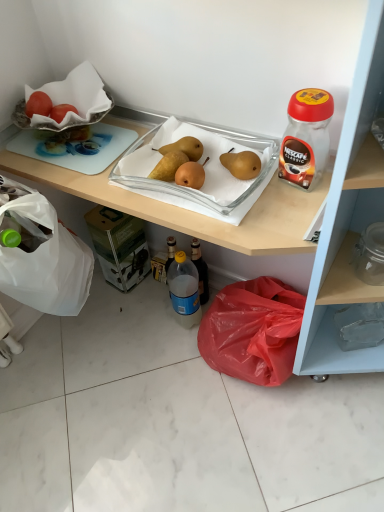
Question: From a real-world perspective, is blue translucent bottle at center, the second bottle when ordered from right to left, on top of matte plastic cabinet at lower right?

Choices:
 (A) yes
 (B) no

Answer: (B)

Question: Can you confirm if blue translucent bottle at center, which is the first bottle from bottom to top, is positioned to the right of matte plastic cabinet at lower right?

Choices:
 (A) yes
 (B) no

Answer: (B)

Question: Considering the relative sizes of blue translucent bottle at center, the second bottle when ordered from right to left, and matte plastic cabinet at lower right in the image provided, is blue translucent bottle at center, the second bottle when ordered from right to left, thinner than matte plastic cabinet at lower right?

Choices:
 (A) no
 (B) yes

Answer: (B)

Question: Can you see blue translucent bottle at center, which appears as the 1th bottle when viewed from the back, touching matte plastic cabinet at lower right?

Choices:
 (A) yes
 (B) no

Answer: (B)

Question: Would you say blue translucent bottle at center, the 2th bottle positioned from the top, is outside matte plastic cabinet at lower right?

Choices:
 (A) yes
 (B) no

Answer: (B)

Question: Is transparent plastic jar at upper right, the 2th bottle when ordered from left to right, wider than matte plastic cabinet at lower right?

Choices:
 (A) yes
 (B) no

Answer: (B)

Question: Is matte plastic cabinet at lower right a part of transparent plastic jar at upper right, marked as the first bottle in a right-to-left arrangement?

Choices:
 (A) no
 (B) yes

Answer: (A)

Question: Is transparent plastic jar at upper right, marked as the first bottle in a right-to-left arrangement, taller than matte plastic cabinet at lower right?

Choices:
 (A) yes
 (B) no

Answer: (B)

Question: Can you confirm if transparent plastic jar at upper right, arranged as the second bottle when ordered from the bottom, is shorter than matte plastic cabinet at lower right?

Choices:
 (A) no
 (B) yes

Answer: (B)

Question: From the image's perspective, is transparent plastic jar at upper right, the first bottle positioned from the top, located above matte plastic cabinet at lower right?

Choices:
 (A) yes
 (B) no

Answer: (A)

Question: Is transparent plastic jar at upper right, the 2th bottle when ordered from left to right, aimed at matte plastic cabinet at lower right?

Choices:
 (A) yes
 (B) no

Answer: (A)

Question: From the image's perspective, would you say transparent plastic jar at upper right, the 2th bottle when ordered from left to right, is shown under yellow matte pears at center?

Choices:
 (A) no
 (B) yes

Answer: (A)